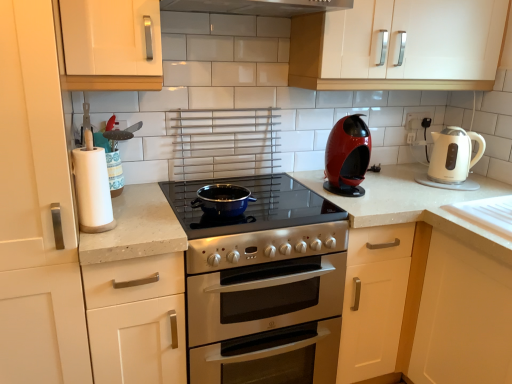
Question: Is white matte cabinet handle at upper left, marked as the 2th cabinetry in a left-to-right arrangement, in front of or behind white plastic electric outlet at upper right in the image?

Choices:
 (A) front
 (B) behind

Answer: (A)

Question: Is white matte cabinet handle at upper left, marked as the 2th cabinetry in a left-to-right arrangement, situated inside white plastic electric outlet at upper right or outside?

Choices:
 (A) outside
 (B) inside

Answer: (A)

Question: Which is farther from the white matte cabinet at left, positioned as the 1th cabinetry in left-to-right order?

Choices:
 (A) white glossy cabinet at upper center, which ranks as the first cabinetry in right-to-left order
 (B) blue enameled wok at center
 (C) white matte cabinet at left, the 2th cabinetry positioned from the right
 (D) white plastic electric outlet at upper right
 (E) white matte paper towel at left

Answer: (D)

Question: Estimate the real-world distances between objects in this image. Which object is closer to the white matte cabinet handle at upper left, positioned as the 3th cabinetry in right-to-left order?

Choices:
 (A) white glossy electric kettle at right, placed as the 1th kitchen appliance when sorted from right to left
 (B) white matte cabinet at left, the third cabinetry positioned from the left
 (C) white plastic electric outlet at upper right
 (D) red glossy coffee machine at center right, the first kitchen appliance in the left-to-right sequence
 (E) white glossy cabinet at upper center, which ranks as the first cabinetry in right-to-left order

Answer: (B)